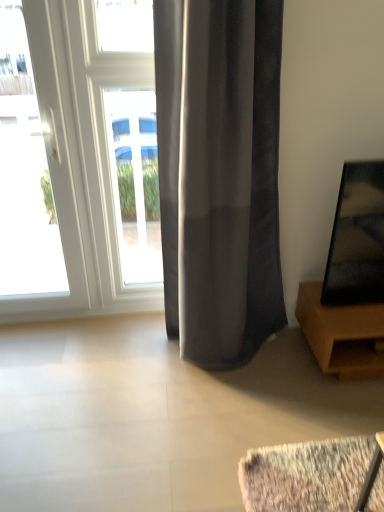
Where is `brown wooden tv stand at right`? The image size is (384, 512). brown wooden tv stand at right is located at coordinates (342, 334).

Find the location of a particular element. The image size is (384, 512). satin gray curtain at center is located at coordinates (220, 174).

At what (x,y) coordinates should I click in order to perform the action: click on white glossy door at left. Please return your answer as a coordinate pair (x, y). Looking at the image, I should click on (55, 188).

Where is `white glossy window at center`? white glossy window at center is located at coordinates (135, 182).

Which of these two, white glossy window at center or white glossy door at left, is bigger?

white glossy door at left.

Between white glossy window at center and white glossy door at left, which one has larger width?

Wider between the two is white glossy door at left.

Is white glossy window at center oriented towards white glossy door at left?

No, white glossy window at center is not oriented towards white glossy door at left.

Who is shorter, brown wooden tv stand at right or white glossy window at center?

Standing shorter between the two is brown wooden tv stand at right.

Is brown wooden tv stand at right facing towards white glossy window at center?

No, brown wooden tv stand at right is not facing towards white glossy window at center.

Are brown wooden tv stand at right and white glossy window at center located far from each other?

brown wooden tv stand at right is far away from white glossy window at center.

Between brown wooden tv stand at right and white glossy window at center, which one has larger size?

With larger size is brown wooden tv stand at right.

Is satin gray curtain at center to the left or to the right of white glossy door at left in the image?

From the image, it's evident that satin gray curtain at center is to the right of white glossy door at left.

Looking at this image, how different are the orientations of satin gray curtain at center and white glossy door at left in degrees?

They differ by 0.00173 degrees in their facing directions.

Considering the positions of point (181, 211) and point (70, 262), is point (181, 211) closer or farther from the camera than point (70, 262)?

Point (181, 211) is positioned closer to the camera compared to point (70, 262).

Considering the relative sizes of satin gray curtain at center and white glossy door at left in the image provided, is satin gray curtain at center bigger than white glossy door at left?

Yes, satin gray curtain at center is bigger than white glossy door at left.

From the picture: Who is bigger, white glossy door at left or satin gray curtain at center?

satin gray curtain at center is bigger.

From a real-world perspective, is white glossy door at left under satin gray curtain at center?

Yes, from a real-world perspective, white glossy door at left is under satin gray curtain at center.

Which object is positioned more to the left, white glossy door at left or satin gray curtain at center?

Positioned to the left is white glossy door at left.

Which is behind, point (70, 188) or point (185, 187)?

Point (70, 188)

Can you confirm if white glossy door at left is shorter than brown wooden tv stand at right?

No, white glossy door at left is not shorter than brown wooden tv stand at right.

Considering the positions of objects white glossy door at left and brown wooden tv stand at right in the image provided, who is more to the left, white glossy door at left or brown wooden tv stand at right?

Positioned to the left is white glossy door at left.

Is white glossy door at left wider or thinner than brown wooden tv stand at right?

Clearly, white glossy door at left has less width compared to brown wooden tv stand at right.

Would you consider white glossy door at left to be distant from brown wooden tv stand at right?

Absolutely, white glossy door at left is distant from brown wooden tv stand at right.

Consider the image. Is the surface of white glossy window at center in direct contact with satin gray curtain at center?

No.

Is white glossy window at center to the left of satin gray curtain at center from the viewer's perspective?

Yes, white glossy window at center is to the left of satin gray curtain at center.

Can you confirm if white glossy window at center is wider than satin gray curtain at center?

No.

From a real-world perspective, is white glossy window at center above or below satin gray curtain at center?

From a real-world perspective, white glossy window at center is physically below satin gray curtain at center.

Between satin gray curtain at center and white glossy window at center, which one is positioned in front?

Positioned in front is satin gray curtain at center.

Which of these two, satin gray curtain at center or white glossy window at center, is thinner?

white glossy window at center is thinner.

Is satin gray curtain at center at the right side of white glossy window at center?

Correct, you'll find satin gray curtain at center to the right of white glossy window at center.

Identify the location of window directly beneath the white glossy door at left (from a real-world perspective). pos(135,182).

In order to click on window above the brown wooden tv stand at right (from a real-world perspective) in this screenshot , I will do `click(135, 182)`.

Estimate the real-world distances between objects in this image. Which object is further from satin gray curtain at center, brown wooden tv stand at right or white glossy window at center?

brown wooden tv stand at right.

Looking at this image, when comparing their distances from brown wooden tv stand at right, does white glossy door at left or white glossy window at center seem closer?

Based on the image, white glossy window at center appears to be nearer to brown wooden tv stand at right.

Which object lies further to the anchor point white glossy door at left, white glossy window at center or brown wooden tv stand at right?

Based on the image, brown wooden tv stand at right appears to be further to white glossy door at left.

From the image, which object appears to be nearer to white glossy window at center, white glossy door at left or brown wooden tv stand at right?

The object closer to white glossy window at center is white glossy door at left.

Consider the image. When comparing their distances from white glossy window at center, does brown wooden tv stand at right or satin gray curtain at center seem further?

Among the two, brown wooden tv stand at right is located further to white glossy window at center.

Based on their spatial positions, is brown wooden tv stand at right or satin gray curtain at center further from white glossy door at left?

brown wooden tv stand at right lies further to white glossy door at left than the other object.

Which object lies nearer to the anchor point white glossy door at left, satin gray curtain at center or white glossy window at center?

white glossy window at center is closer to white glossy door at left.

When comparing their distances from white glossy door at left, does brown wooden tv stand at right or white glossy window at center seem closer?

white glossy window at center lies closer to white glossy door at left than the other object.

Find the location of a particular element. curtain between white glossy door at left and brown wooden tv stand at right from left to right is located at coordinates (220, 174).

The height and width of the screenshot is (512, 384). What are the coordinates of `window between white glossy door at left and brown wooden tv stand at right from left to right` in the screenshot? It's located at (135, 182).

I want to click on curtain situated between white glossy window at center and brown wooden tv stand at right from left to right, so click(x=220, y=174).

Find the location of a particular element. This screenshot has height=512, width=384. window situated between white glossy door at left and satin gray curtain at center from left to right is located at coordinates (135, 182).